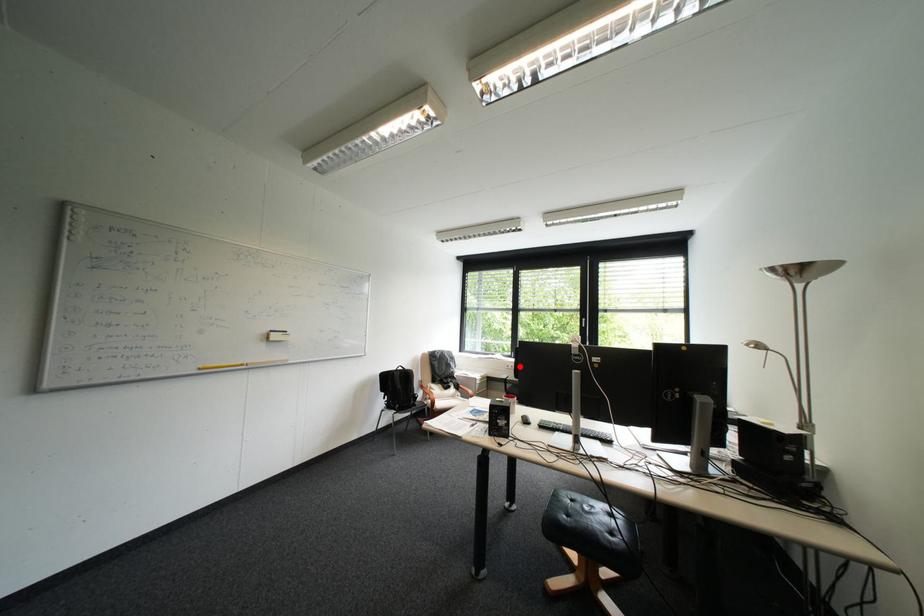
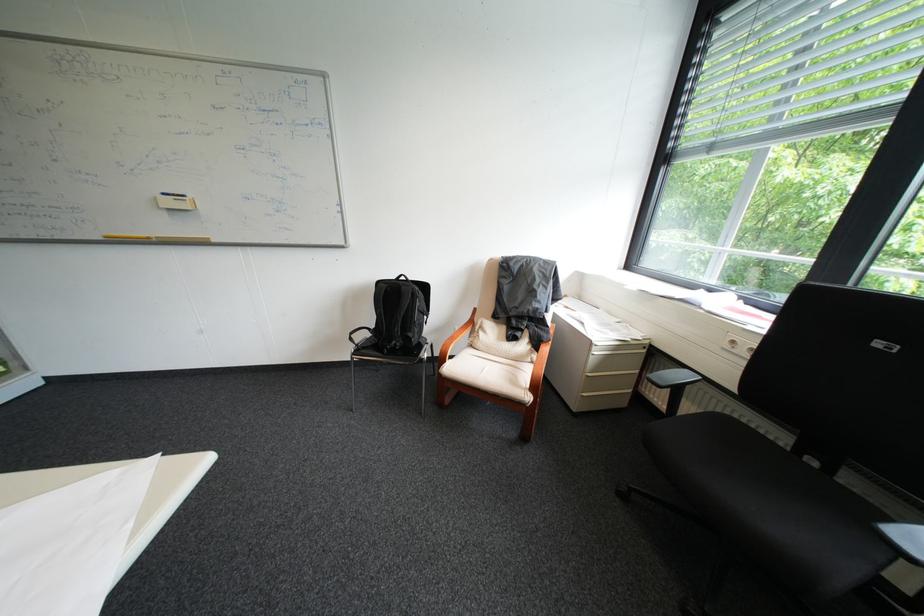
Question: I am providing you with two images of the same scene from different viewpoints. In image1, a red point is highlighted. Considering the same 3D point in image2, which of the following is correct?

Choices:
 (A) It is closer
 (B) It is farther

Answer: (A)